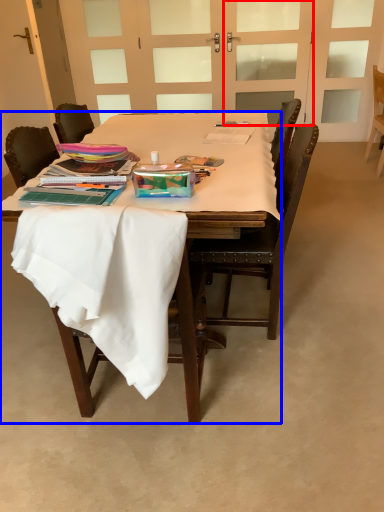
Question: Which of the following is the farthest to the observer, screen door (highlighted by a red box) or desk (highlighted by a blue box)?

Choices:
 (A) screen door
 (B) desk

Answer: (A)